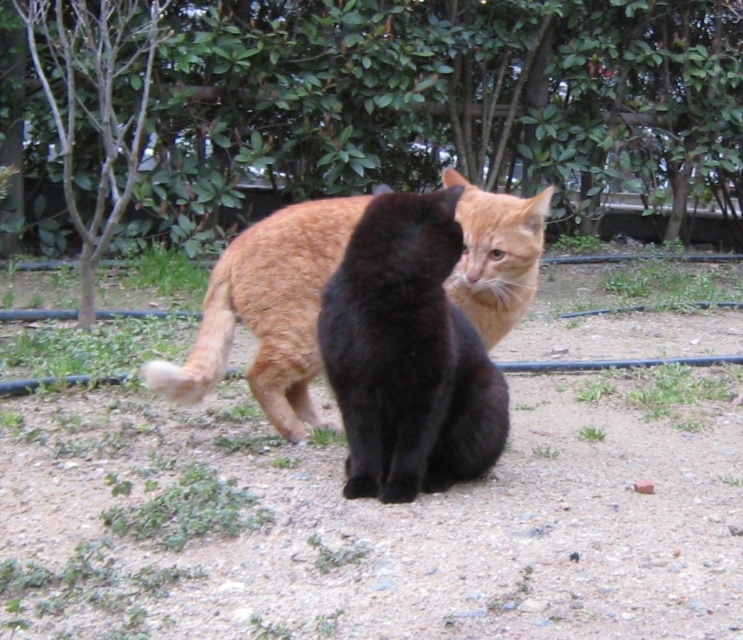
Does black fur cat at center appear on the right side of orange fur cat at center?

Yes, black fur cat at center is to the right of orange fur cat at center.

Can you confirm if black fur cat at center is bigger than orange fur cat at center?

No, black fur cat at center is not bigger than orange fur cat at center.

Identify the location of black fur cat at center. Image resolution: width=743 pixels, height=640 pixels. (408, 355).

You are a GUI agent. You are given a task and a screenshot of the screen. Output one action in this format:
    pyautogui.click(x=<x>, y=<y>)
    Task: Click on the black fur cat at center
    
    Given the screenshot: What is the action you would take?
    pyautogui.click(x=408, y=355)